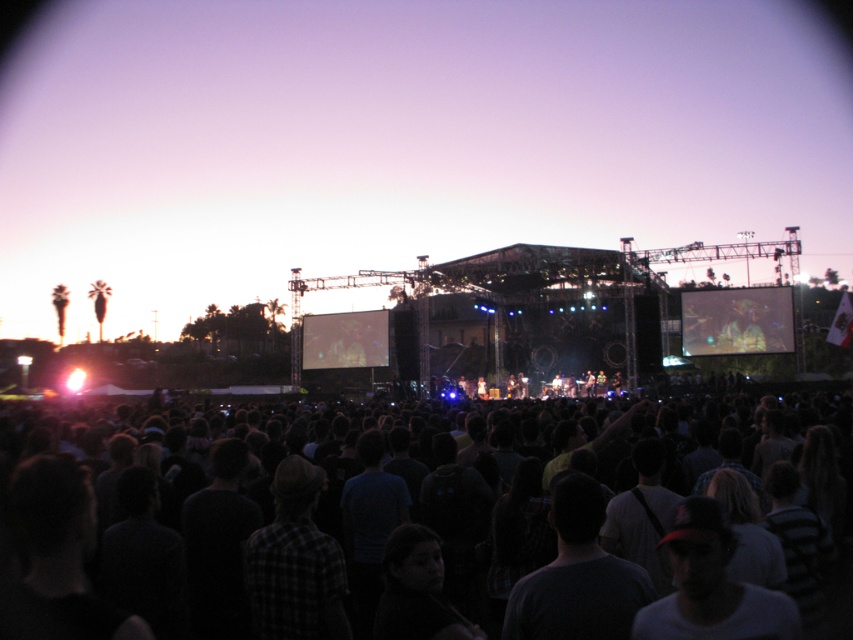
Is point (734, 340) more distant than point (358, 332)?

No, it is not.

Measure the distance between point (757, 308) and camera.

Point (757, 308) is 140.48 meters away from camera.

Identify the location of matte black screen at center. The height and width of the screenshot is (640, 853). (737, 321).

Is dark casual clothing at center thinner than matte screen at center?

In fact, dark casual clothing at center might be wider than matte screen at center.

Which of these two, dark casual clothing at center or matte screen at center, stands shorter?

With less height is matte screen at center.

I want to click on dark casual clothing at center, so click(x=753, y=476).

Can you confirm if dark casual clothing at center is wider than matte black screen at center?

Yes.

Describe the element at coordinates (753, 476) in the screenshot. I see `dark casual clothing at center` at that location.

Where is `dark casual clothing at center`? The height and width of the screenshot is (640, 853). dark casual clothing at center is located at coordinates (753, 476).